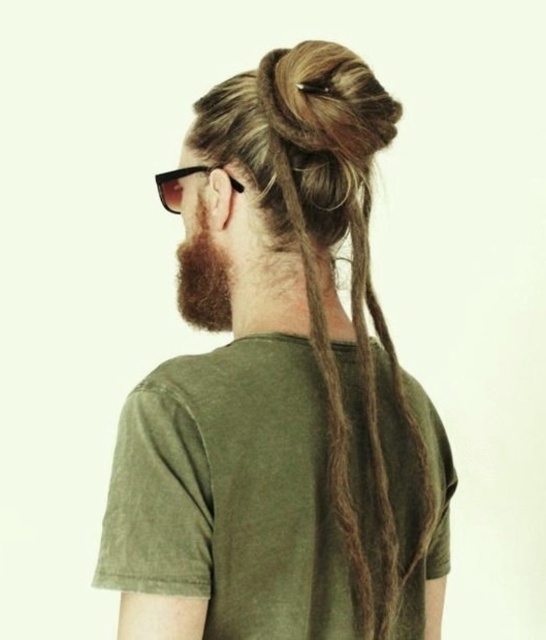
Which of these two, brown matte hair at upper center or black plastic sunglasses at upper center, stands taller?

brown matte hair at upper center is taller.

Does brown matte hair at upper center have a lesser width compared to black plastic sunglasses at upper center?

No.

Does point (361, 369) come closer to viewer compared to point (169, 180)?

Yes, point (361, 369) is closer to viewer.

At what (x,y) coordinates should I click in order to perform the action: click on brown matte hair at upper center. Please return your answer as a coordinate pair (x, y). This screenshot has height=640, width=546. Looking at the image, I should click on (282, 396).

Does dark brown fuzzy beard at center come in front of black plastic sunglasses at upper center?

No, dark brown fuzzy beard at center is further to the viewer.

Is dark brown fuzzy beard at center further to camera compared to black plastic sunglasses at upper center?

Yes, dark brown fuzzy beard at center is behind black plastic sunglasses at upper center.

Where is `dark brown fuzzy beard at center`? The width and height of the screenshot is (546, 640). dark brown fuzzy beard at center is located at coordinates (203, 280).

Who is higher up, brown matte hair at upper center or dark brown fuzzy beard at center?

dark brown fuzzy beard at center

Can you confirm if brown matte hair at upper center is positioned above dark brown fuzzy beard at center?

Incorrect, brown matte hair at upper center is not positioned above dark brown fuzzy beard at center.

Between point (428, 580) and point (181, 248), which one is positioned in front?

Point (428, 580) is in front.

Find the location of `brown matte hair at upper center`. brown matte hair at upper center is located at coordinates tap(282, 396).